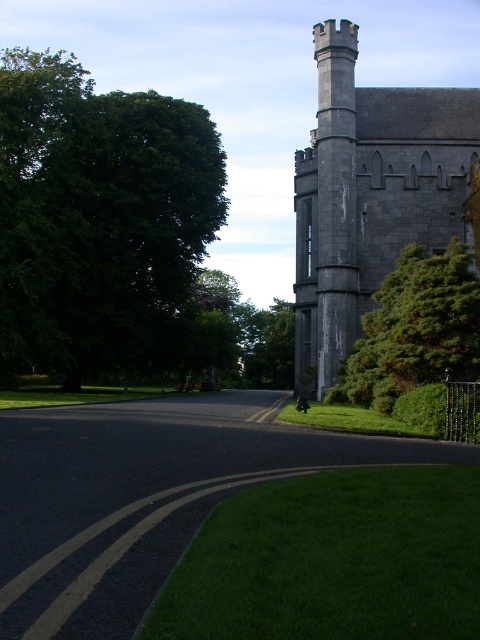
Question: Observing the image, what is the correct spatial positioning of gray stone tower at upper right in reference to green textured bush at right?

Choices:
 (A) left
 (B) right

Answer: (B)

Question: Can you confirm if gray stone tower at upper right is positioned to the left of green textured bush at right?

Choices:
 (A) yes
 (B) no

Answer: (B)

Question: Among these objects, which one is farthest from the camera?

Choices:
 (A) gray stone tower at upper right
 (B) green leafy tree at left
 (C) green textured bush at right

Answer: (B)

Question: Does green leafy tree at left appear on the left side of green textured bush at right?

Choices:
 (A) yes
 (B) no

Answer: (A)

Question: Which object is the farthest from the gray stone tower at upper right?

Choices:
 (A) green textured bush at right
 (B) green leafy tree at left

Answer: (B)

Question: Which point is closer to the camera taking this photo?

Choices:
 (A) (406, 179)
 (B) (206, 144)

Answer: (A)